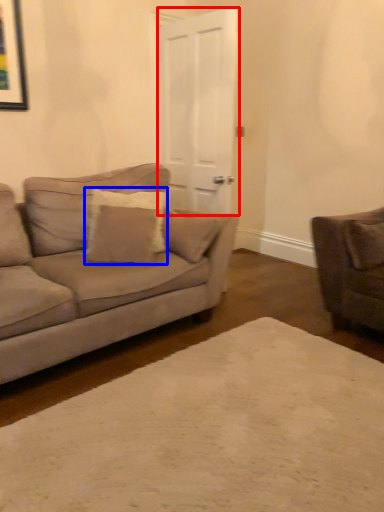
Question: Which object is further to the camera taking this photo, glass door (highlighted by a red box) or pillow (highlighted by a blue box)?

Choices:
 (A) glass door
 (B) pillow

Answer: (A)